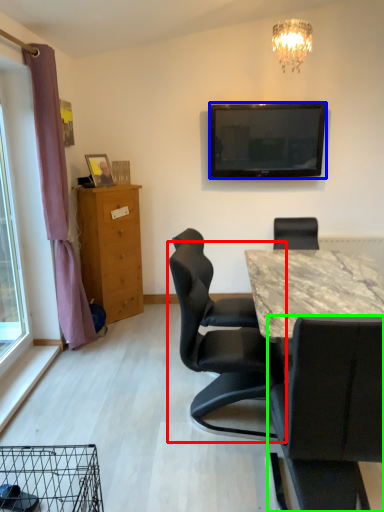
Question: Which object is positioned farthest from chair (highlighted by a red box)? Select from television (highlighted by a blue box) and chair (highlighted by a green box).

Choices:
 (A) television
 (B) chair

Answer: (A)